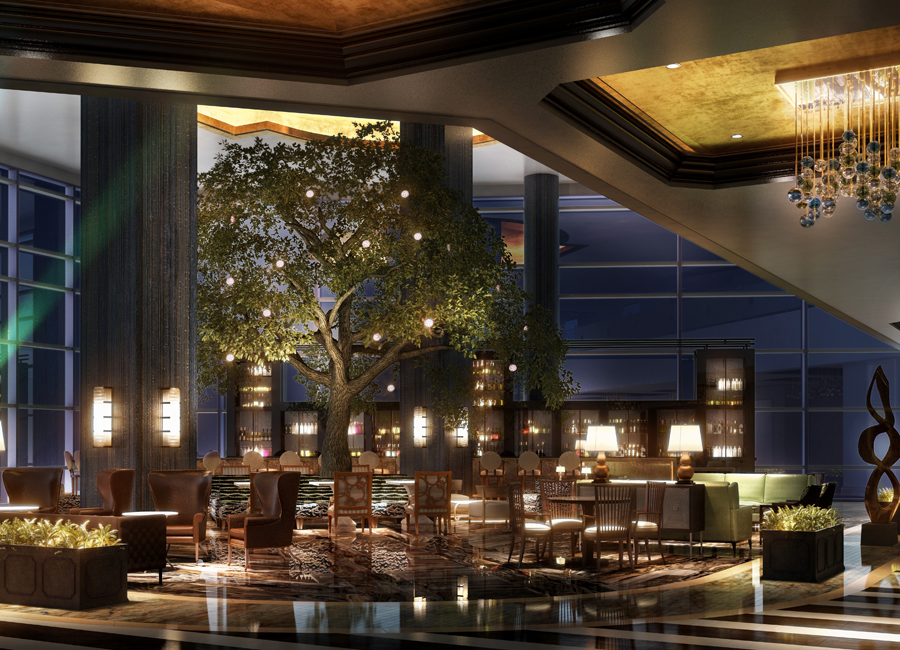
Where is `column`? The width and height of the screenshot is (900, 650). column is located at coordinates (150, 279).